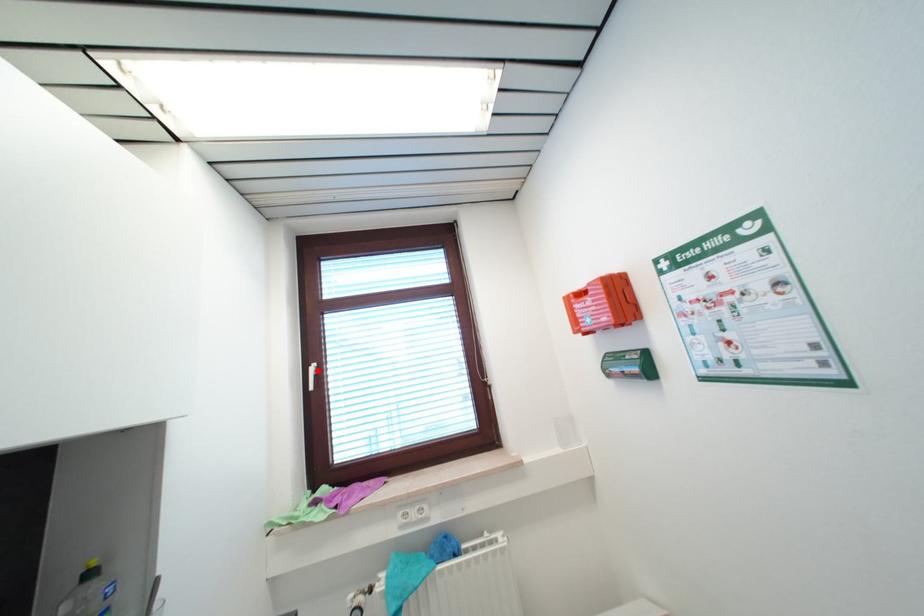
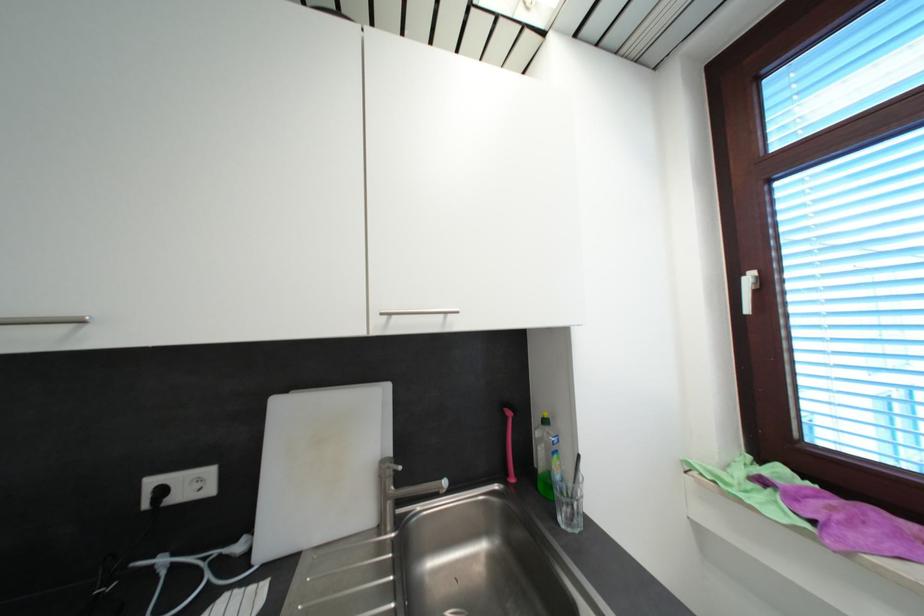
Question: A red point is marked in image1. In image2, is the corresponding 3D point closer to the camera or farther? Reply with the corresponding letter.

Choices:
 (A) The corresponding 3D point is closer.
 (B) The corresponding 3D point is farther.

Answer: (A)